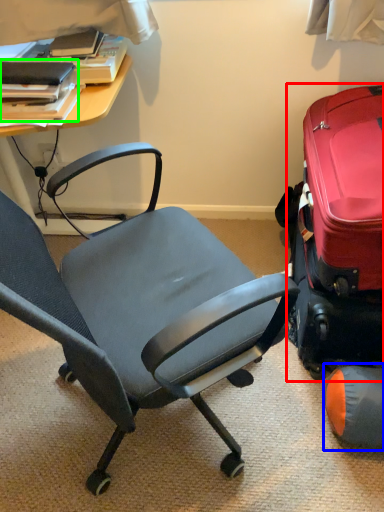
Question: Considering the real-world distances, which object is closest to suitcase (highlighted by a red box)? bean bag chair (highlighted by a blue box) or book (highlighted by a green box).

Choices:
 (A) bean bag chair
 (B) book

Answer: (A)